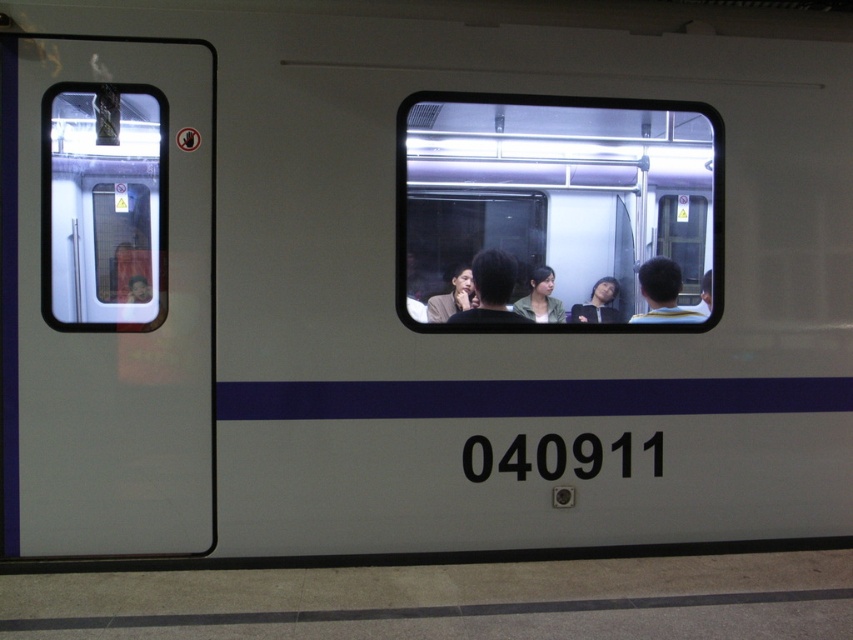
Does point (706, 227) come farther from viewer compared to point (675, 284)?

That is True.

I want to click on transparent glass train window at center, so click(x=561, y=208).

Which is above, transparent glass train window at center or matte black shirt at center?

transparent glass train window at center is higher up.

Does transparent glass train window at center come in front of matte black shirt at center?

Yes, it is.

What do you see at coordinates (561, 208) in the screenshot?
I see `transparent glass train window at center` at bounding box center [561, 208].

At what (x,y) coordinates should I click in order to perform the action: click on transparent glass train window at center. Please return your answer as a coordinate pair (x, y). Looking at the image, I should click on (561, 208).

Consider the image. Is transparent glass train window at left closer to camera compared to matte black shirt at center?

Yes, transparent glass train window at left is in front of matte black shirt at center.

Who is more forward, [86,120] or [509,320]?

Point [86,120] is more forward.

Locate an element on the screen. transparent glass train window at left is located at coordinates (103, 208).